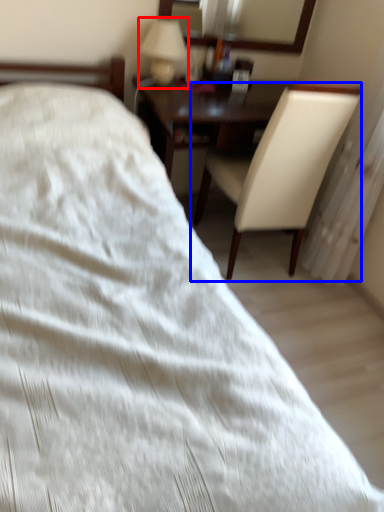
Question: Which point is further to the camera, table lamp (highlighted by a red box) or chair (highlighted by a blue box)?

Choices:
 (A) table lamp
 (B) chair

Answer: (A)